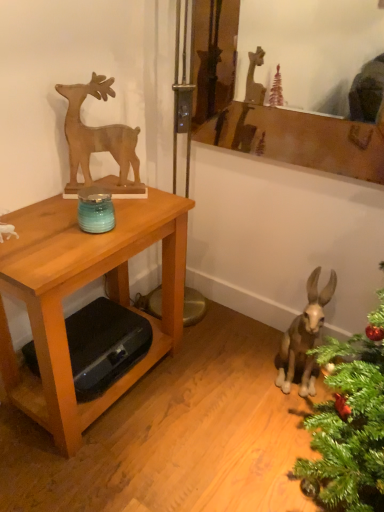
This screenshot has height=512, width=384. What are the coordinates of `vacant area located to the right-hand side of wooden table at left` in the screenshot? It's located at (219, 395).